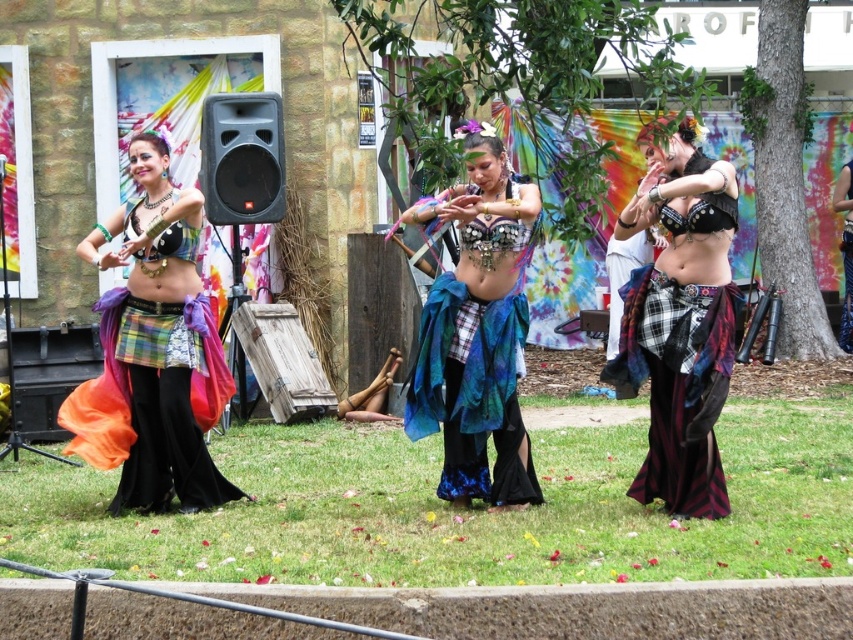
Does plaid fabric skirt at center appear on the right side of shiny blue fabric skirt at center?

Yes, plaid fabric skirt at center is to the right of shiny blue fabric skirt at center.

From the picture: Who is more distant from viewer, (x=643, y=321) or (x=512, y=218)?

The point (x=643, y=321) is more distant.

The image size is (853, 640). Find the location of `plaid fabric skirt at center`. plaid fabric skirt at center is located at coordinates (680, 323).

Who is taller, matte plaid skirt at center or plaid fabric skirt at center?

With more height is matte plaid skirt at center.

Does matte plaid skirt at center come behind plaid fabric skirt at center?

Yes, it is.

At what (x,y) coordinates should I click in order to perform the action: click on matte plaid skirt at center. Please return your answer as a coordinate pair (x, y). This screenshot has height=640, width=853. Looking at the image, I should click on (154, 352).

You are a GUI agent. You are given a task and a screenshot of the screen. Output one action in this format:
    pyautogui.click(x=<x>, y=<y>)
    Task: Click on the matte plaid skirt at center
    The width and height of the screenshot is (853, 640).
    Given the screenshot: What is the action you would take?
    pyautogui.click(x=154, y=352)

Does matte plaid skirt at center have a greater width compared to shiny blue fabric skirt at center?

Yes.

Between matte plaid skirt at center and shiny blue fabric skirt at center, which one has less height?

shiny blue fabric skirt at center is shorter.

Is point (86, 244) positioned in front of point (421, 378)?

That is False.

Locate an element on the screen. matte plaid skirt at center is located at coordinates [154, 352].